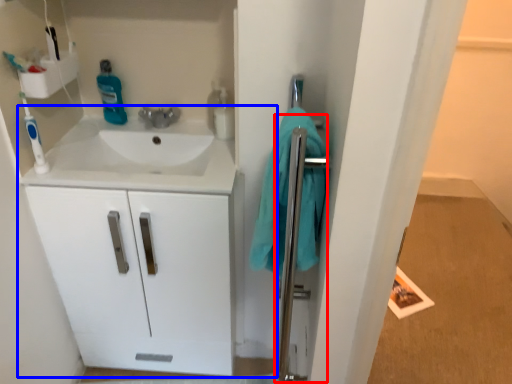
Question: Which of the following is the farthest to the observer, shower door (highlighted by a red box) or bathroom cabinet (highlighted by a blue box)?

Choices:
 (A) shower door
 (B) bathroom cabinet

Answer: (B)